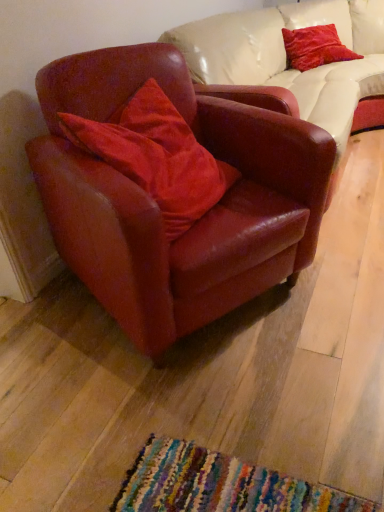
Consider the image. In order to face velvet red pillow at center, which ranks as the 2th pillow in right-to-left order, should I rotate leftwards or rightwards?

Rotate left and turn 4.664 degrees.

This screenshot has height=512, width=384. What do you see at coordinates (156, 206) in the screenshot?
I see `leather armchair at left` at bounding box center [156, 206].

Where is `velvet red pillow at center, which is counted as the 2th pillow, starting from the back`? The width and height of the screenshot is (384, 512). velvet red pillow at center, which is counted as the 2th pillow, starting from the back is located at coordinates (156, 156).

From the image's perspective, is leather armchair at left on velvet red pillow at upper right, the 2th pillow from the left?

No, from the image's perspective, leather armchair at left is not above velvet red pillow at upper right, the 2th pillow from the left.

You are a GUI agent. You are given a task and a screenshot of the screen. Output one action in this format:
    pyautogui.click(x=<x>, y=<y>)
    Task: Click on the chair in front of the velvet red pillow at upper right, arranged as the first pillow when viewed from the top
    This screenshot has height=512, width=384.
    Given the screenshot: What is the action you would take?
    pyautogui.click(x=156, y=206)

Would you say velvet red pillow at upper right, arranged as the 2th pillow when ordered from the bottom, is part of leather armchair at left's contents?

Actually, velvet red pillow at upper right, arranged as the 2th pillow when ordered from the bottom, is outside leather armchair at left.

Is point (120, 106) farther from camera compared to point (303, 34)?

That is False.

How far apart are velvet red pillow at upper right, which ranks as the first pillow in right-to-left order, and velvet red pillow at center, which is the first pillow in front-to-back order?

velvet red pillow at upper right, which ranks as the first pillow in right-to-left order, is 6.04 feet away from velvet red pillow at center, which is the first pillow in front-to-back order.

Looking at this image, can you confirm if velvet red pillow at upper right, the 2th pillow from the left, is positioned to the right of velvet red pillow at center, acting as the 2th pillow starting from the top?

Yes.

Is velvet red pillow at upper right, positioned as the 1th pillow in back-to-front order, in front of or behind velvet red pillow at center, arranged as the first pillow when viewed from the left, in the image?

Clearly, velvet red pillow at upper right, positioned as the 1th pillow in back-to-front order, is behind velvet red pillow at center, arranged as the first pillow when viewed from the left.

Are velvet red pillow at upper right, which ranks as the first pillow in right-to-left order, and leather armchair at left making contact?

No, velvet red pillow at upper right, which ranks as the first pillow in right-to-left order, is not making contact with leather armchair at left.

Is velvet red pillow at upper right, the 2th pillow from the left, taller than leather armchair at left?

No.

From the image's perspective, between velvet red pillow at upper right, the 2th pillow from the left, and leather armchair at left, who is located below?

leather armchair at left, from the image's perspective.

Consider the image. Are velvet red pillow at center, which ranks as the 2th pillow in right-to-left order, and velvet red pillow at upper right, the second pillow viewed from the front, beside each other?

There is a gap between velvet red pillow at center, which ranks as the 2th pillow in right-to-left order, and velvet red pillow at upper right, the second pillow viewed from the front.

Between velvet red pillow at center, acting as the 2th pillow starting from the top, and velvet red pillow at upper right, which ranks as the first pillow in right-to-left order, which one appears on the right side from the viewer's perspective?

From the viewer's perspective, velvet red pillow at upper right, which ranks as the first pillow in right-to-left order, appears more on the right side.

Is velvet red pillow at center, acting as the 2th pillow starting from the top, positioned beyond the bounds of velvet red pillow at upper right, the second pillow viewed from the front?

Yes, velvet red pillow at center, acting as the 2th pillow starting from the top, is outside of velvet red pillow at upper right, the second pillow viewed from the front.

Is velvet red pillow at center, acting as the 2th pillow starting from the top, turned away from velvet red pillow at upper right, positioned as the 1th pillow in back-to-front order?

velvet red pillow at center, acting as the 2th pillow starting from the top, is not turned away from velvet red pillow at upper right, positioned as the 1th pillow in back-to-front order.

From a real-world perspective, does leather armchair at left stand above velvet red pillow at center, which appears as the 1th pillow when ordered from the bottom?

Incorrect, from a real-world perspective, leather armchair at left is lower than velvet red pillow at center, which appears as the 1th pillow when ordered from the bottom.

Is leather armchair at left next to velvet red pillow at center, which appears as the 1th pillow when ordered from the bottom, and touching it?

They are not placed beside each other.

Which is closer to the camera, (118,92) or (86,120)?

The point (86,120) is more forward.

How far apart are leather armchair at left and velvet red pillow at center, arranged as the first pillow when viewed from the left?

leather armchair at left is 17.35 centimeters from velvet red pillow at center, arranged as the first pillow when viewed from the left.

Which is closer to the camera, (198, 213) or (262, 133)?

Point (198, 213) is closer to the camera than point (262, 133).

From the image's perspective, which one is positioned lower, velvet red pillow at center, which appears as the 1th pillow when ordered from the bottom, or leather armchair at left?

leather armchair at left.

Find the location of a particular element. This screenshot has height=512, width=384. chair on the right of velvet red pillow at center, which appears as the 1th pillow when ordered from the bottom is located at coordinates (156, 206).

The height and width of the screenshot is (512, 384). In the image, there is a velvet red pillow at upper right, the 2th pillow from the left. Identify the location of chair below it (from the image's perspective). (156, 206).

Where is `pillow on the left of the velvet red pillow at upper right, positioned as the 1th pillow in back-to-front order`? This screenshot has width=384, height=512. pillow on the left of the velvet red pillow at upper right, positioned as the 1th pillow in back-to-front order is located at coordinates (156, 156).

Which object lies nearer to the anchor point leather armchair at left, velvet red pillow at upper right, positioned as the 1th pillow in back-to-front order, or velvet red pillow at center, which appears as the 1th pillow when ordered from the bottom?

Among the two, velvet red pillow at center, which appears as the 1th pillow when ordered from the bottom, is located nearer to leather armchair at left.

Looking at the image, which one is located closer to velvet red pillow at upper right, the 2th pillow from the left, leather armchair at left or velvet red pillow at center, which ranks as the 2th pillow in right-to-left order?

The object closer to velvet red pillow at upper right, the 2th pillow from the left, is leather armchair at left.

Looking at the image, which one is located closer to velvet red pillow at center, which ranks as the 2th pillow in right-to-left order, leather armchair at left or velvet red pillow at upper right, which ranks as the first pillow in right-to-left order?

The object closer to velvet red pillow at center, which ranks as the 2th pillow in right-to-left order, is leather armchair at left.

From the picture: When comparing their distances from leather armchair at left, does velvet red pillow at center, which ranks as the 2th pillow in right-to-left order, or velvet red pillow at upper right, which ranks as the first pillow in right-to-left order, seem further?

velvet red pillow at upper right, which ranks as the first pillow in right-to-left order, is further to leather armchair at left.

When comparing their distances from velvet red pillow at center, which is counted as the 2th pillow, starting from the back, does velvet red pillow at upper right, arranged as the 2th pillow when ordered from the bottom, or leather armchair at left seem closer?

leather armchair at left is positioned closer to the anchor velvet red pillow at center, which is counted as the 2th pillow, starting from the back.

Estimate the real-world distances between objects in this image. Which object is further from velvet red pillow at upper right, positioned as the 1th pillow in back-to-front order, velvet red pillow at center, arranged as the first pillow when viewed from the left, or leather armchair at left?

velvet red pillow at center, arranged as the first pillow when viewed from the left, is positioned further to the anchor velvet red pillow at upper right, positioned as the 1th pillow in back-to-front order.

Identify the location of pillow between leather armchair at left and velvet red pillow at upper right, the second pillow viewed from the front, from front to back. (156, 156).